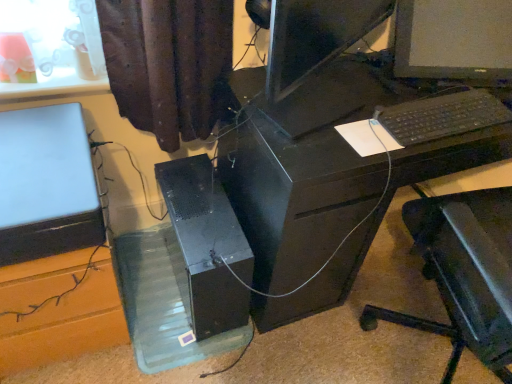
This screenshot has width=512, height=384. Identify the location of vacant space to the left of black plastic keyboard at right. (350, 99).